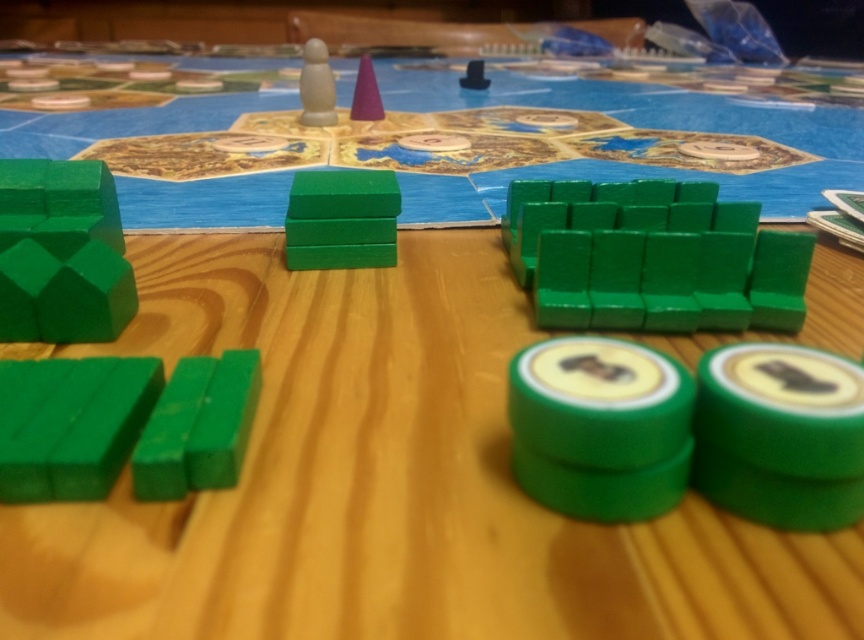
Can you confirm if purple matte cone at center is thinner than black plastic cube at upper center?

Indeed, purple matte cone at center has a lesser width compared to black plastic cube at upper center.

Which is behind, point (366, 108) or point (464, 83)?

The point (464, 83) is more distant.

Identify the location of purple matte cone at center. This screenshot has height=640, width=864. (365, 93).

Does green matte token at lower right appear under green matte rectangular block at lower left?

Actually, green matte token at lower right is above green matte rectangular block at lower left.

Can you confirm if green matte token at lower right is thinner than green matte rectangular block at lower left?

In fact, green matte token at lower right might be wider than green matte rectangular block at lower left.

What do you see at coordinates (780, 435) in the screenshot?
I see `green matte token at lower right` at bounding box center [780, 435].

This screenshot has width=864, height=640. In order to click on green matte token at lower right in this screenshot , I will do `click(780, 435)`.

Which is more to the left, green matte token at lower right or purple matte cone at center?

Positioned to the left is purple matte cone at center.

Does point (786, 496) come in front of point (378, 104)?

Yes, point (786, 496) is in front of point (378, 104).

What are the coordinates of `green matte token at lower right` in the screenshot? It's located at (780, 435).